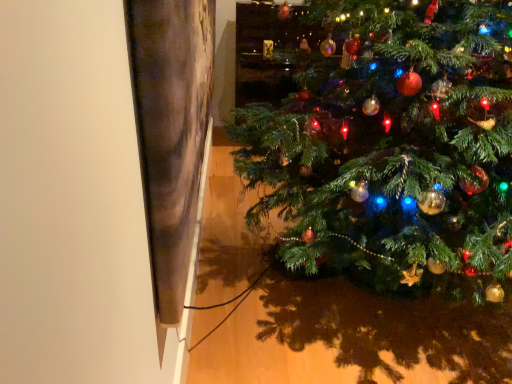
Identify the location of green matte christmas tree at center. Image resolution: width=512 pixels, height=384 pixels. (391, 145).

This screenshot has height=384, width=512. Describe the element at coordinates (391, 145) in the screenshot. I see `green matte christmas tree at center` at that location.

At what (x,y) coordinates should I click in order to perform the action: click on green matte christmas tree at center. Please return your answer as a coordinate pair (x, y). The height and width of the screenshot is (384, 512). Looking at the image, I should click on (391, 145).